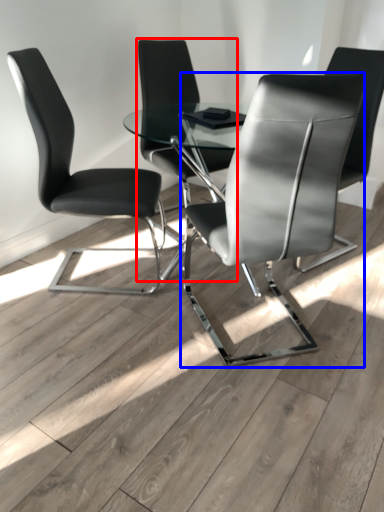
Question: Among these objects, which one is farthest to the camera, chair (highlighted by a red box) or chair (highlighted by a blue box)?

Choices:
 (A) chair
 (B) chair

Answer: (A)